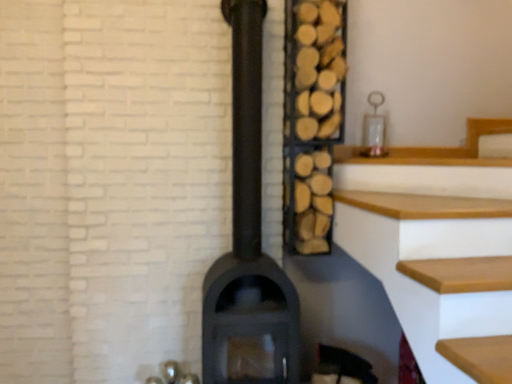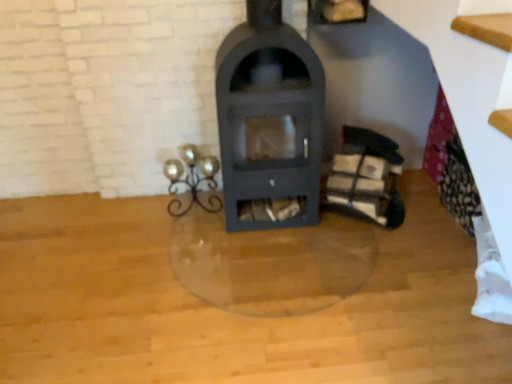
Question: How did the camera likely rotate when shooting the video?

Choices:
 (A) rotated downward
 (B) rotated upward

Answer: (A)